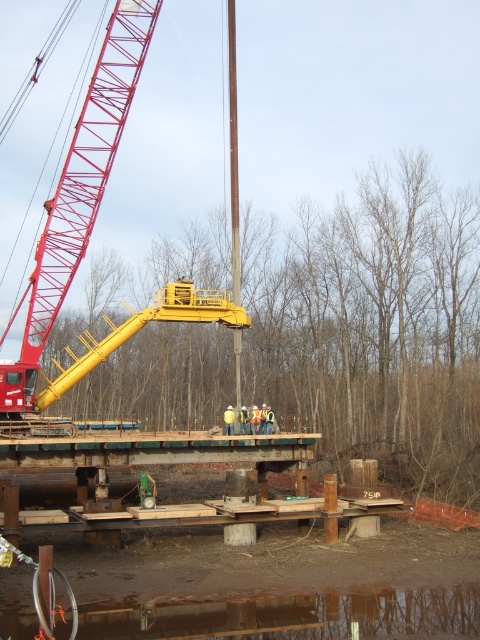
Question: Which object is closer to the camera taking this photo?

Choices:
 (A) red metal crane at upper left
 (B) brown reflective water at lower center

Answer: (B)

Question: Is red metal crane at upper left below brown reflective water at lower center?

Choices:
 (A) no
 (B) yes

Answer: (A)

Question: Which point appears farthest from the camera in this image?

Choices:
 (A) (285, 609)
 (B) (118, 74)

Answer: (B)

Question: In this image, where is red metal crane at upper left located relative to brown reflective water at lower center?

Choices:
 (A) above
 (B) below

Answer: (A)

Question: Is red metal crane at upper left thinner than brown reflective water at lower center?

Choices:
 (A) yes
 (B) no

Answer: (B)